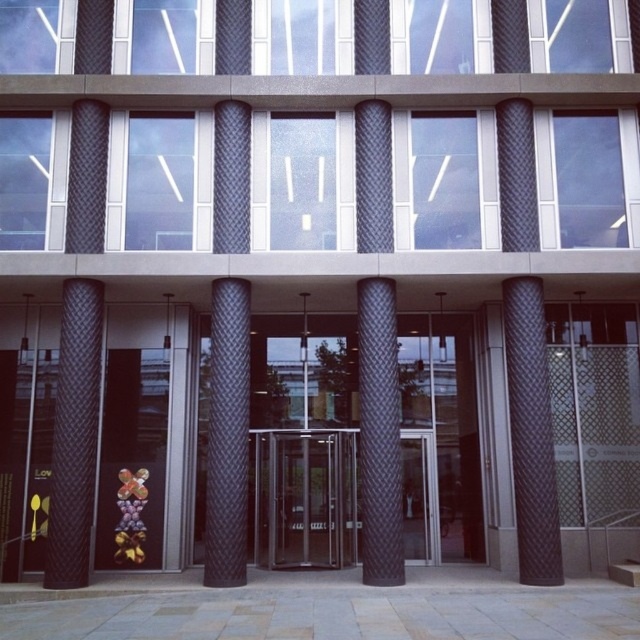
Between black quilted fabric pillar at right and black textured pillar at center, which one is positioned higher?

black quilted fabric pillar at right is higher up.

Who is shorter, black quilted fabric pillar at right or black textured pillar at center?

black textured pillar at center is shorter.

The width and height of the screenshot is (640, 640). What do you see at coordinates (531, 433) in the screenshot? I see `black quilted fabric pillar at right` at bounding box center [531, 433].

You are a GUI agent. You are given a task and a screenshot of the screen. Output one action in this format:
    pyautogui.click(x=<x>, y=<y>)
    Task: Click on the black quilted fabric pillar at right
    The width and height of the screenshot is (640, 640).
    Given the screenshot: What is the action you would take?
    pyautogui.click(x=531, y=433)

Is black textured pillar at center to the right of black textured column at center from the viewer's perspective?

No, black textured pillar at center is not to the right of black textured column at center.

Between black textured pillar at center and black textured column at center, which one has less height?

Standing shorter between the two is black textured column at center.

What do you see at coordinates (227, 435) in the screenshot?
I see `black textured pillar at center` at bounding box center [227, 435].

Find the location of a particular element. black textured pillar at center is located at coordinates (227, 435).

Can you confirm if black quilted pillar at left is thinner than black textured pillar at center?

Correct, black quilted pillar at left's width is less than black textured pillar at center's.

Describe the element at coordinates (74, 435) in the screenshot. I see `black quilted pillar at left` at that location.

Describe the element at coordinates (74, 435) in the screenshot. I see `black quilted pillar at left` at that location.

I want to click on black quilted pillar at left, so [74, 435].